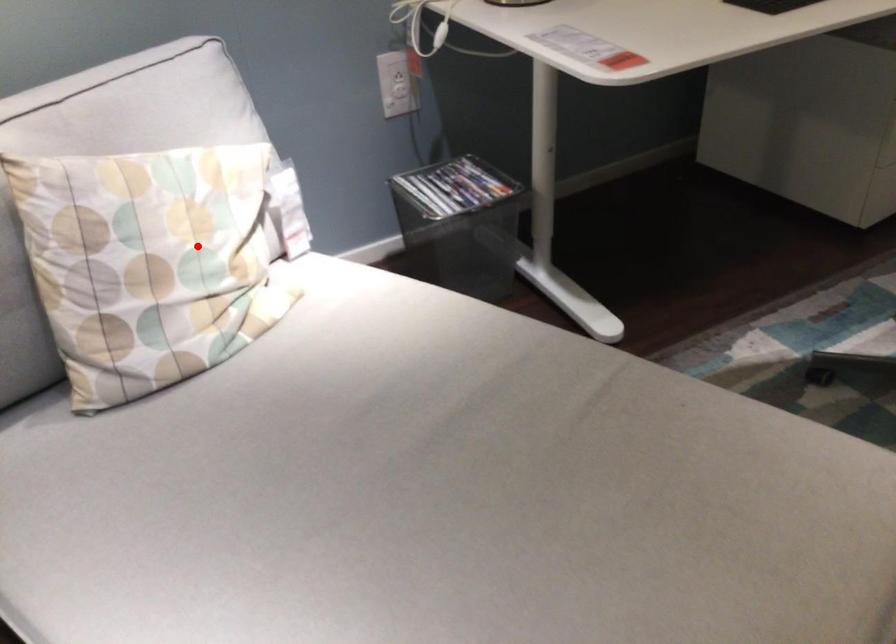
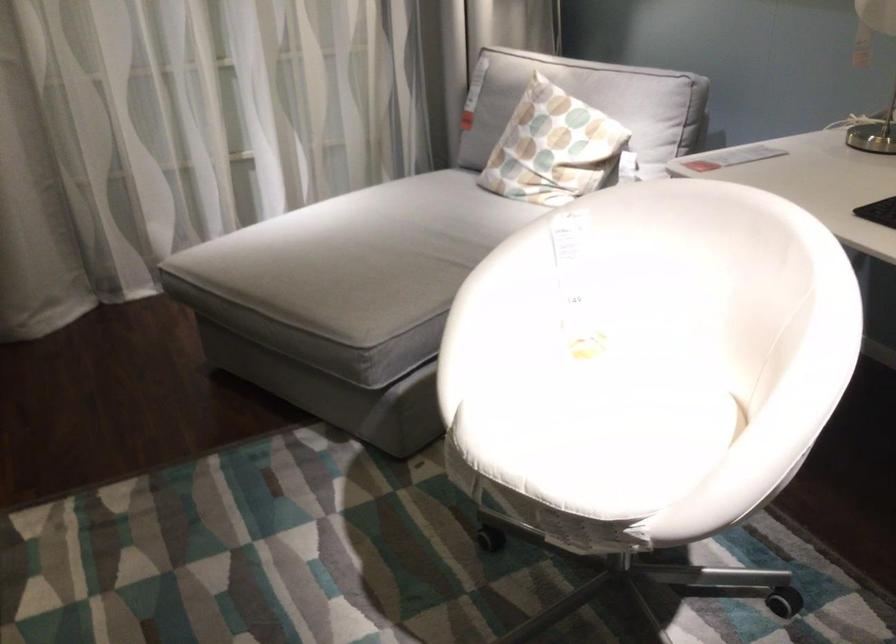
Question: I am providing you with two images of the same scene from different viewpoints. A red point is shown in image1. For the corresponding object point in image2, is it positioned nearer or farther from the camera?

Choices:
 (A) Nearer
 (B) Farther

Answer: (B)